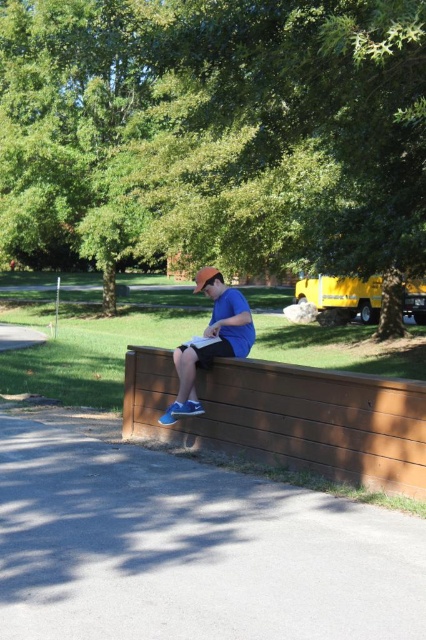
Is point (195, 438) positioned before point (226, 317)?

No.

Which of these two, brown wooden bench at center or matte blue shorts at center, stands taller?

With more height is matte blue shorts at center.

Which is in front, point (314, 464) or point (213, 289)?

Point (314, 464) is more forward.

The height and width of the screenshot is (640, 426). I want to click on brown wooden bench at center, so click(x=288, y=419).

Is green leafy tree at upper center closer to the viewer compared to matte blue shorts at center?

Yes, green leafy tree at upper center is in front of matte blue shorts at center.

Is green leafy tree at upper center shorter than matte blue shorts at center?

No, green leafy tree at upper center is not shorter than matte blue shorts at center.

Which is behind, point (62, 196) or point (236, 337)?

The point (62, 196) is more distant.

At what (x,y) coordinates should I click in order to perform the action: click on green leafy tree at upper center. Please return your answer as a coordinate pair (x, y). Image resolution: width=426 pixels, height=640 pixels. Looking at the image, I should click on (215, 129).

In the scene shown: Between green leafy tree at upper center and brown wooden bench at center, which one appears on the left side from the viewer's perspective?

green leafy tree at upper center

Does green leafy tree at upper center appear on the right side of brown wooden bench at center?

In fact, green leafy tree at upper center is to the left of brown wooden bench at center.

What do you see at coordinates (215, 129) in the screenshot? The image size is (426, 640). I see `green leafy tree at upper center` at bounding box center [215, 129].

The width and height of the screenshot is (426, 640). Identify the location of green leafy tree at upper center. (215, 129).